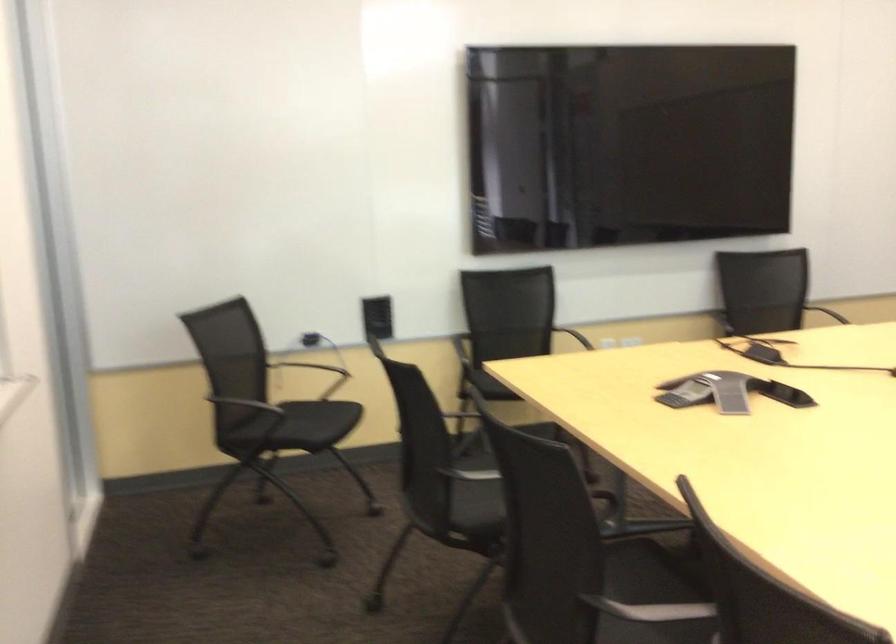
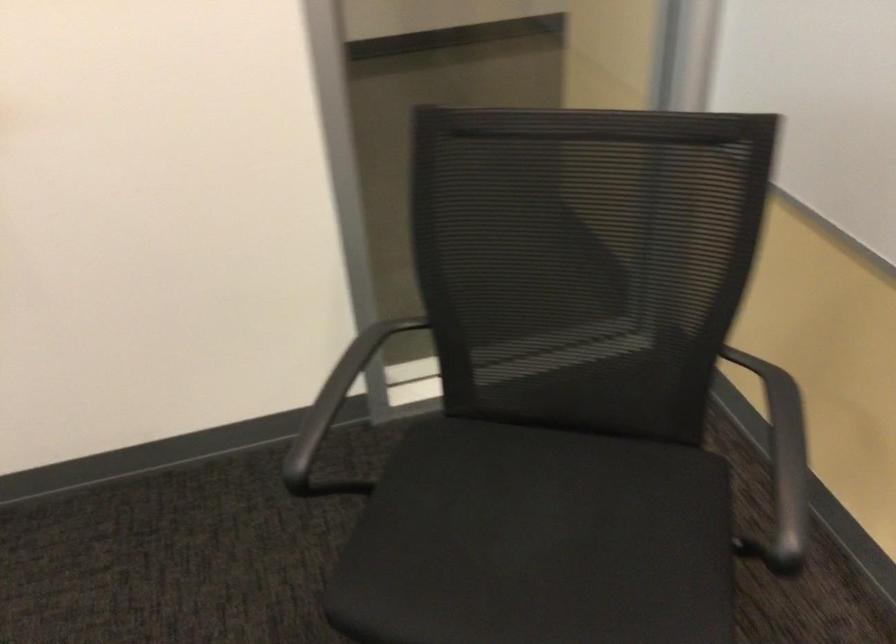
Locate, in the second image, the point that corresponds to point 309,419 in the first image.

(538, 542)